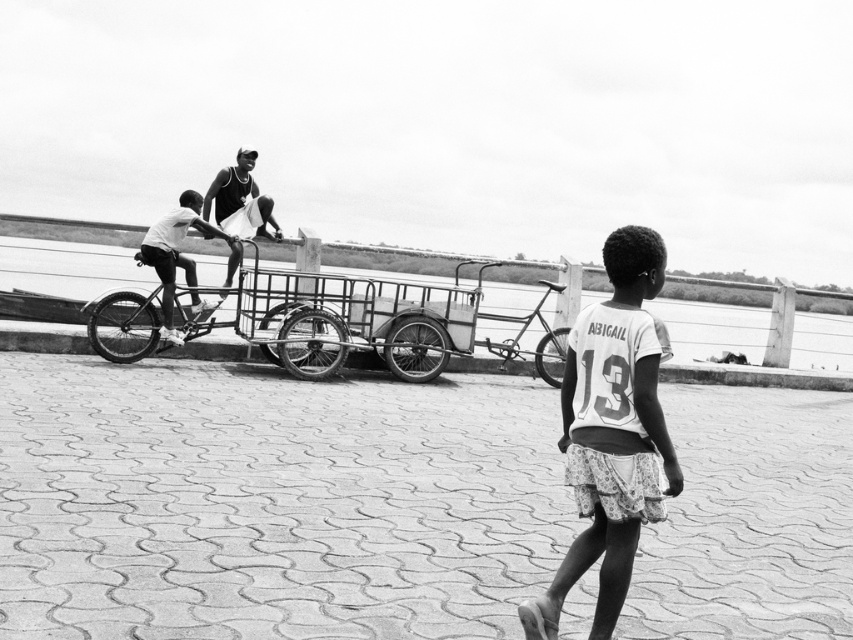
Can you confirm if white fabric shirt at center is positioned below metallic silver bicycle at center?

Indeed, white fabric shirt at center is positioned under metallic silver bicycle at center.

Is white fabric shirt at center shorter than metallic silver bicycle at center?

No, white fabric shirt at center is not shorter than metallic silver bicycle at center.

Is point (624, 518) less distant than point (117, 324)?

That is True.

Locate an element on the screen. The image size is (853, 640). white fabric shirt at center is located at coordinates (611, 433).

Is white fabric shirt at center taller than metallic wire cart at center?

Incorrect, white fabric shirt at center's height is not larger of metallic wire cart at center's.

Which of these two, white fabric shirt at center or metallic wire cart at center, stands taller?

Standing taller between the two is metallic wire cart at center.

Who is more distant from viewer, (666, 484) or (552, 314)?

Point (552, 314)

Where is `white fabric shirt at center`? white fabric shirt at center is located at coordinates (611, 433).

Which is more to the right, white fabric shirt at center or dark gray fabric shirt at center?

white fabric shirt at center

Can you confirm if white fabric shirt at center is taller than dark gray fabric shirt at center?

Correct, white fabric shirt at center is much taller as dark gray fabric shirt at center.

Who is more distant from viewer, (550, 595) or (157, 246)?

The point (157, 246) is behind.

Where is `white fabric shirt at center`? white fabric shirt at center is located at coordinates (611, 433).